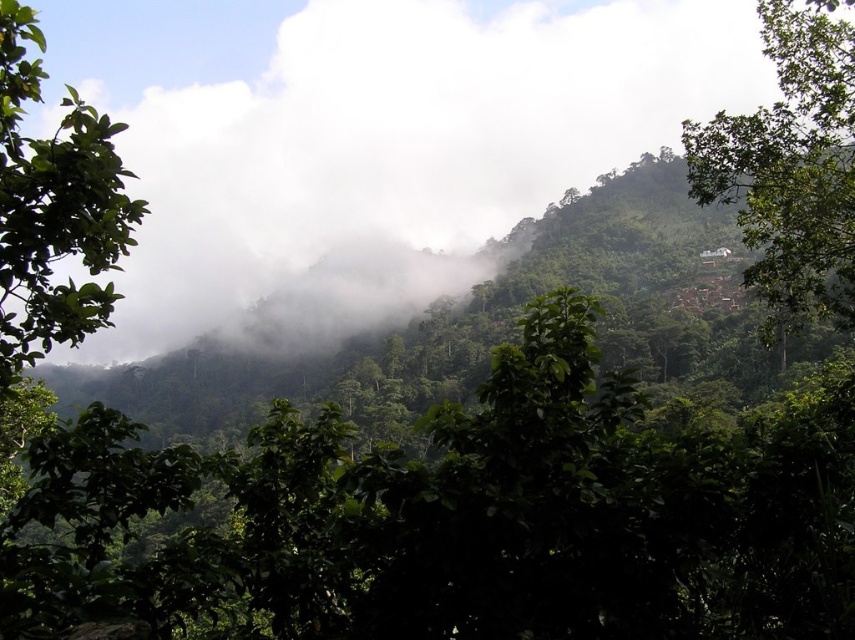
Describe the element at coordinates (369, 138) in the screenshot. I see `white fluffy cloud at upper center` at that location.

Can you confirm if white fluffy cloud at upper center is positioned to the right of green leafy tree at upper right?

Incorrect, white fluffy cloud at upper center is not on the right side of green leafy tree at upper right.

Locate an element on the screen. This screenshot has height=640, width=855. white fluffy cloud at upper center is located at coordinates (369, 138).

Who is more distant from viewer, (821, 237) or (56, 193)?

The point (821, 237) is behind.

Is point (839, 276) positioned after point (0, 10)?

That is True.

Locate an element on the screen. Image resolution: width=855 pixels, height=640 pixels. green leafy tree at upper right is located at coordinates (791, 163).

Does white fluffy cloud at upper center have a lesser width compared to green leafy tree at left?

Incorrect, white fluffy cloud at upper center's width is not less than green leafy tree at left's.

Is the position of white fluffy cloud at upper center more distant than that of green leafy tree at left?

Yes, it is behind green leafy tree at left.

Is point (172, 248) farther from viewer compared to point (9, 243)?

Yes, it is behind point (9, 243).

In order to click on white fluffy cloud at upper center in this screenshot , I will do `click(369, 138)`.